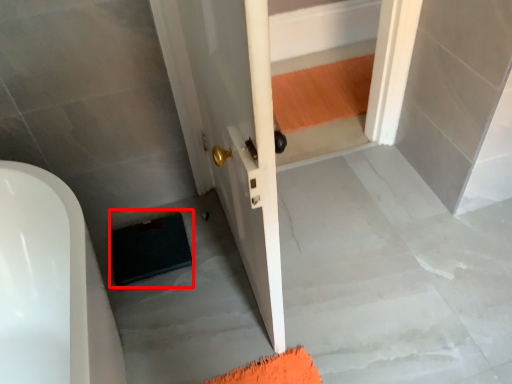
Question: From the image's perspective, considering the relative positions of doormat (annotated by the red box) and concrete in the image provided, where is doormat (annotated by the red box) located with respect to the staircase?

Choices:
 (A) below
 (B) above

Answer: (B)